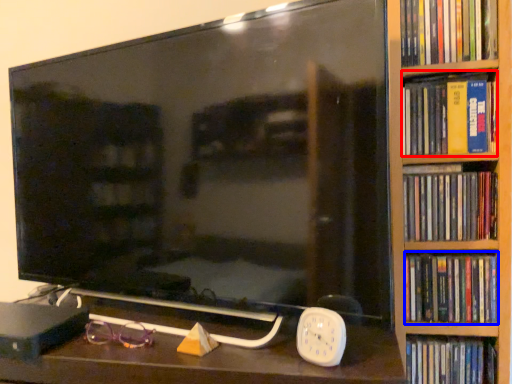
Question: Which of the following is the closest to the observer, book (highlighted by a red box) or book (highlighted by a blue box)?

Choices:
 (A) book
 (B) book

Answer: (A)